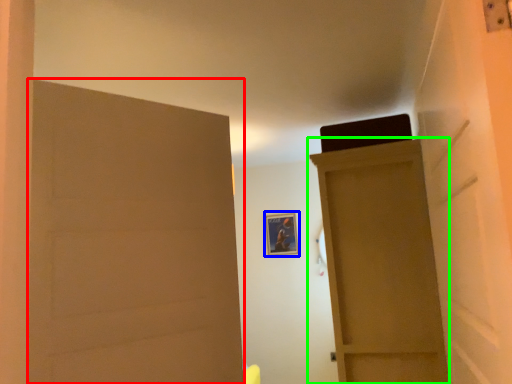
Question: Which is farther away from door (highlighted by a red box)? picture frame (highlighted by a blue box) or door (highlighted by a green box)?

Choices:
 (A) picture frame
 (B) door

Answer: (A)